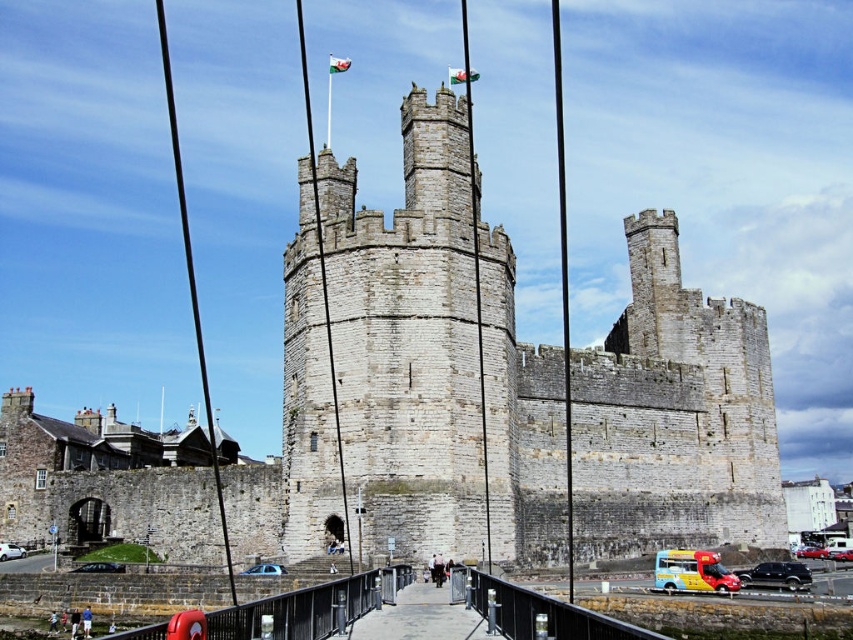
You are standing at the base of the historic stone castle and want to cross to the other side using the metallic gray bridge at center. Considering the distance between you and the bridge, can you safely walk directly to the bridge without needing to move around any obstacles?

The metallic gray bridge at center is 23.75 meters away from you, so yes, you can safely walk directly to the bridge without needing to move around any obstacles since there is enough space between you and the bridge.

You are standing at the base of the castle and looking towards the pedestrian bridge. There are two points marked on the bridge, point (355,387) and point (231,627). Which point is closer to you?

Point (231,627) is closer to you because it is less further to the camera than point (355,387).

You are a tour guide leading a group to the gray stone castle at center. The concrete walkway at center is the only path to reach it. Can you estimate if the castle is wider than the walkway?

The gray stone castle at center is wider than the concrete walkway at center, so yes, the castle is wider than the walkway.